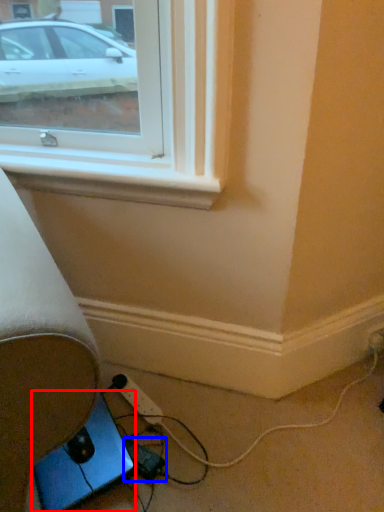
Question: Which object appears farthest to the camera in this image, gadget (highlighted by a red box) or extension cord (highlighted by a blue box)?

Choices:
 (A) gadget
 (B) extension cord

Answer: (B)